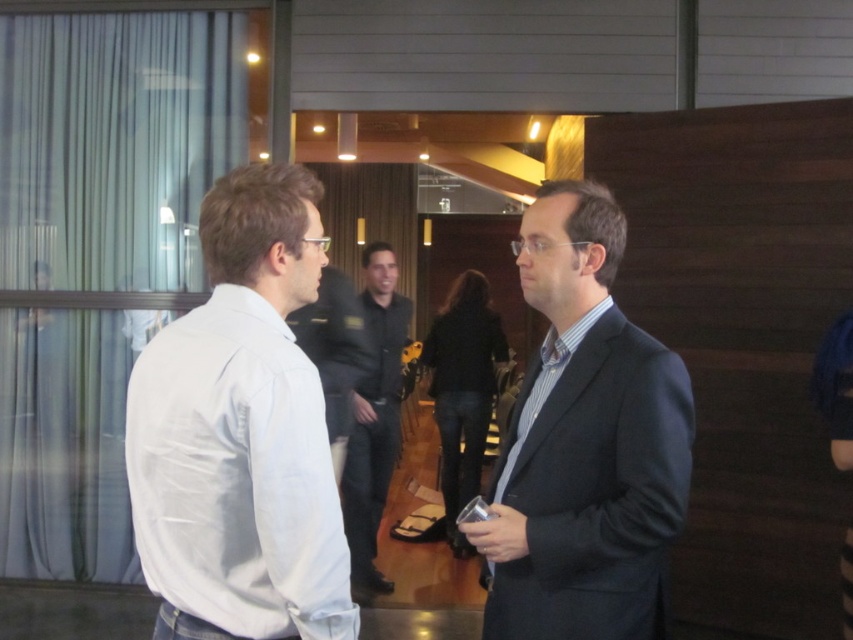
You are a photographer at the event and want to capture a photo that includes both the white cotton shirt at left and the dark blue suit at center without any part of them being cut off. Given their heights, which one should you focus on to ensure both are fully visible in the frame?

The white cotton shirt at left is shorter than the dark blue suit at center. To ensure both are fully visible, focus on the dark blue suit at center as the taller subject, adjusting the frame to include its full height, which will naturally include the shorter white cotton shirt at left.

You are standing at the entrance of the event space and want to greet both the person wearing the dark blue suit at center and the person wearing the dark gray shirt at center. If you walk straight ahead, which one will you reach first?

The dark blue suit at center is 7.64 feet away from the dark gray shirt at center. Since you are walking straight ahead, you will reach the dark gray shirt at center first because it is closer to you than the dark blue suit at center.

You are a photographer at the event and want to ensure both the dark blue suit at center and the dark gray shirt at center are visible in your photo. Given their heights, which one might you need to adjust your camera angle to capture fully?

The dark blue suit at center has a lesser height compared to dark gray shirt at center, so you might need to lower the camera angle slightly to ensure the taller dark gray shirt at center is fully captured while still including the shorter dark blue suit at center in the frame.